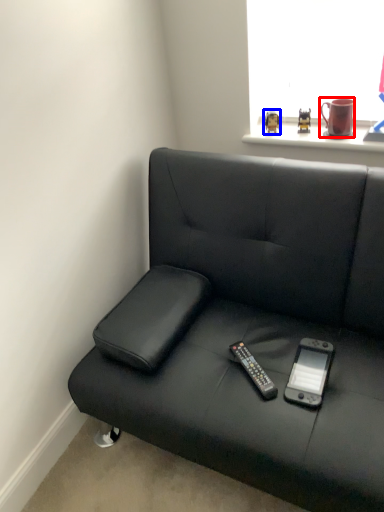
Question: Among these objects, which one is farthest to the camera, mug (highlighted by a red box) or toy (highlighted by a blue box)?

Choices:
 (A) mug
 (B) toy

Answer: (B)